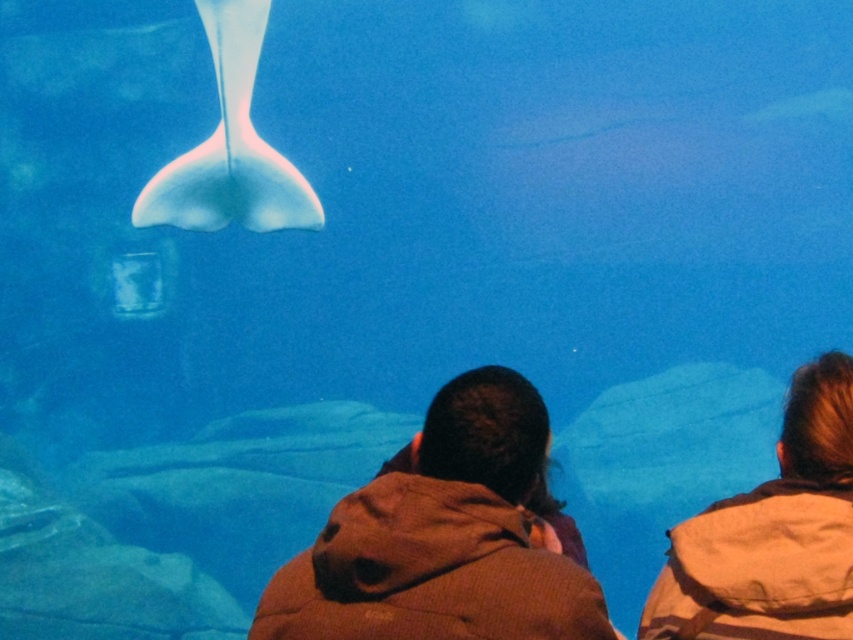
You are a visitor at the aquarium and see the brown textured jacket at upper right and the translucent white stingray at upper center. Which object is taller in the image?

The translucent white stingray at upper center is taller than the brown textured jacket at upper right.

You are standing in the aquarium and see the brown textured jacket at upper right and the translucent white stingray at upper center. Which object is positioned to the right side of the other?

The brown textured jacket at upper right is positioned to the right of the translucent white stingray at upper center.